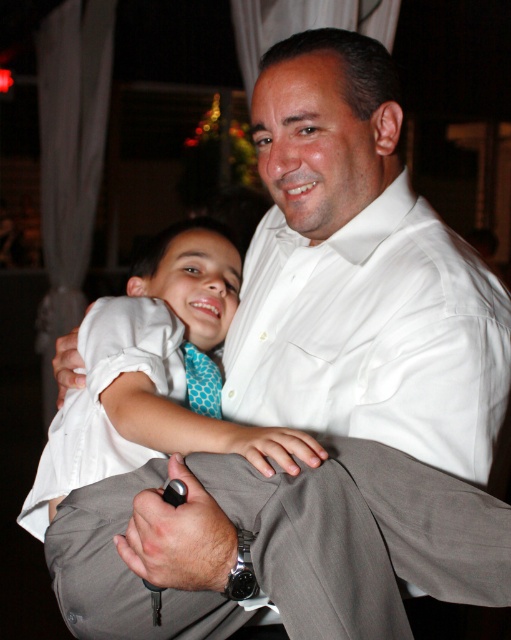
Question: Does white smooth dress shirt at center appear over white cotton shirt at center?

Choices:
 (A) no
 (B) yes

Answer: (B)

Question: Which object is farther from the camera taking this photo?

Choices:
 (A) white cotton dress at center
 (B) white smooth dress shirt at center
 (C) blue dotted tie at center

Answer: (C)

Question: Is white smooth dress shirt at center above white cotton shirt at center?

Choices:
 (A) no
 (B) yes

Answer: (B)

Question: Is white cotton dress at center further to the viewer compared to blue dotted tie at center?

Choices:
 (A) no
 (B) yes

Answer: (A)

Question: Which object is closer to the camera taking this photo?

Choices:
 (A) white cotton shirt at center
 (B) white smooth dress shirt at center

Answer: (A)

Question: Estimate the real-world distances between objects in this image. Which object is closer to the white smooth dress shirt at center?

Choices:
 (A) white cotton dress at center
 (B) blue dotted tie at center

Answer: (A)